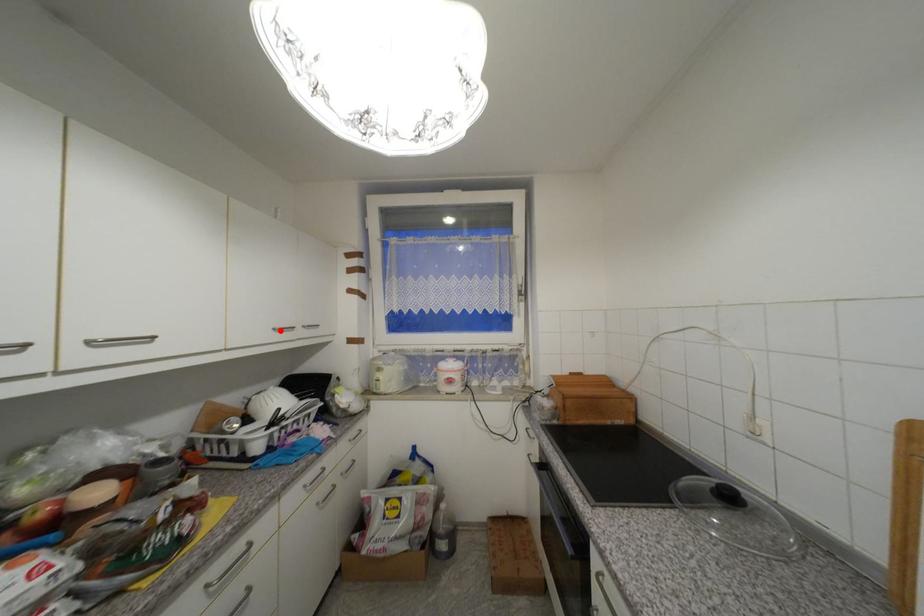
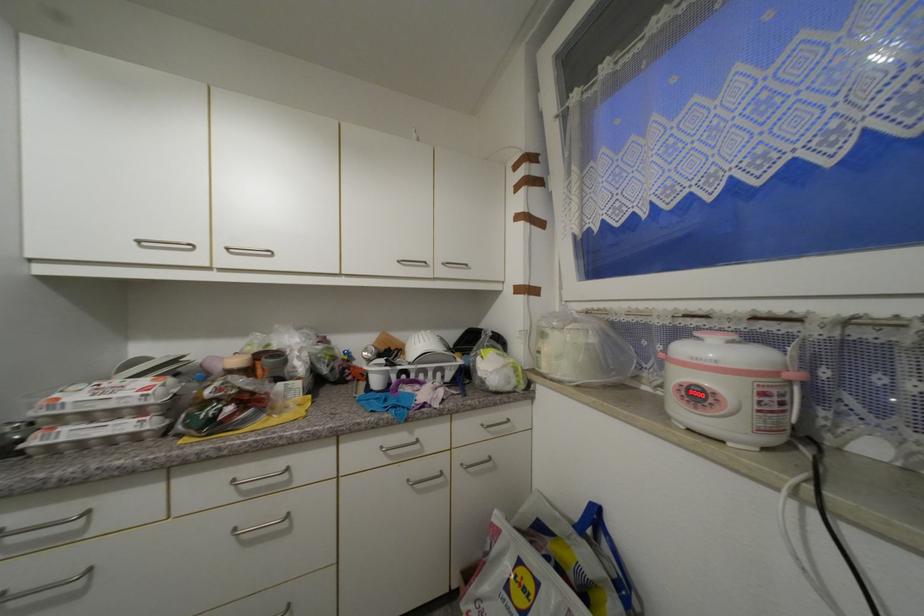
Find the pixel in the second image that matches the highlighted location in the first image.

(405, 262)